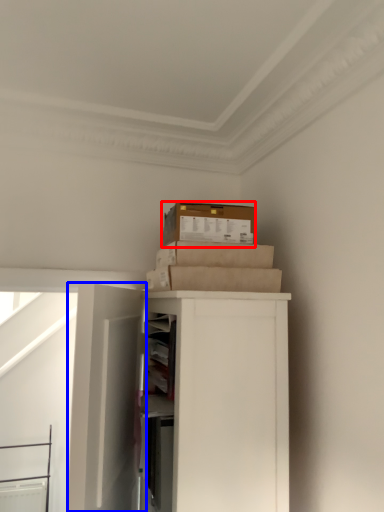
Question: Which point is closer to the camera, box (highlighted by a red box) or door (highlighted by a blue box)?

Choices:
 (A) box
 (B) door

Answer: (B)